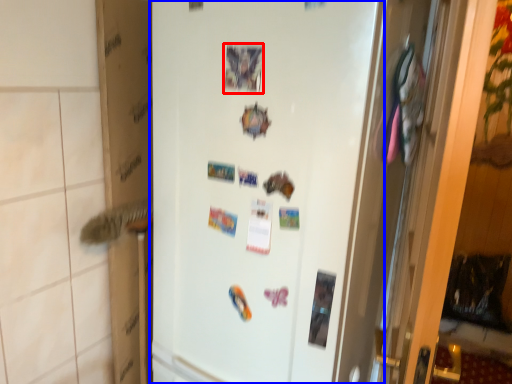
Question: Which of the following is the closest to the observer, postcard (highlighted by a red box) or refrigerator (highlighted by a blue box)?

Choices:
 (A) postcard
 (B) refrigerator

Answer: (B)